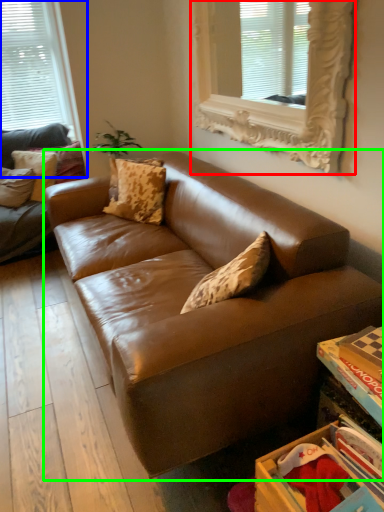
Question: Considering the real-world distances, which object is farthest from window (highlighted by a red box)? window (highlighted by a blue box) or studio couch (highlighted by a green box)?

Choices:
 (A) window
 (B) studio couch

Answer: (A)